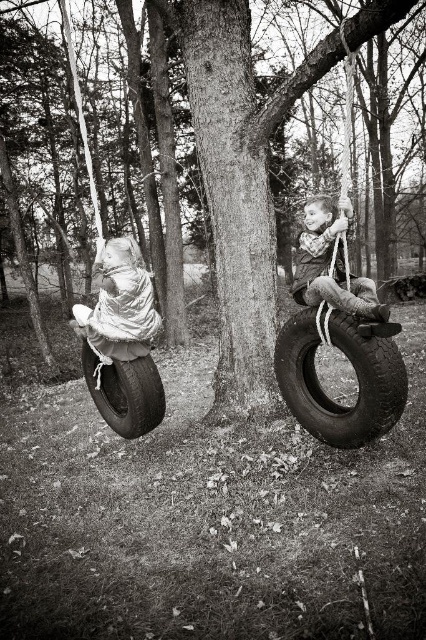
Question: Is smooth bark tree at center wider than white fabric-covered object at left?

Choices:
 (A) yes
 (B) no

Answer: (B)

Question: Does rubber/soft tire at right lie behind rubber tire swing at left?

Choices:
 (A) yes
 (B) no

Answer: (B)

Question: Can you confirm if rubber/soft tire at right is positioned above white fabric-covered object at left?

Choices:
 (A) no
 (B) yes

Answer: (A)

Question: Which of these objects is positioned closest to the smooth bark tree at center?

Choices:
 (A) rubber tire swing at left
 (B) white fabric-covered object at left
 (C) rubber/soft tire at right

Answer: (C)

Question: Among these objects, which one is farthest from the camera?

Choices:
 (A) rubber tire swing at left
 (B) rubber tire at left

Answer: (B)

Question: Estimate the real-world distances between objects in this image. Which object is farther from the white fabric-covered object at left?

Choices:
 (A) rubber tire at left
 (B) smooth fabric child at right

Answer: (B)